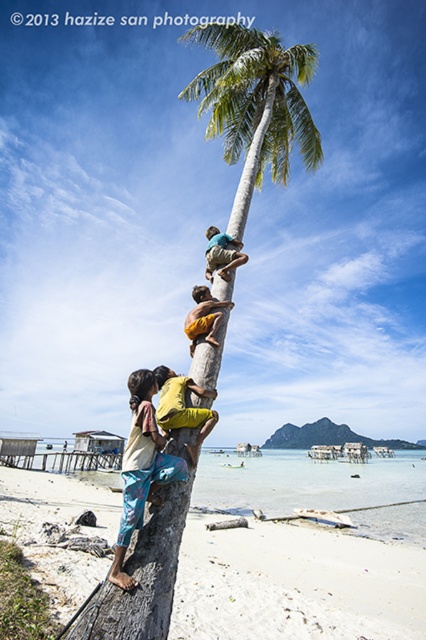
Question: Which of these objects is positioned closest to the white sand beach at lower left?

Choices:
 (A) yellow fabric at center
 (B) yellow fabric shirt at center
 (C) blue printed pants at lower left

Answer: (A)

Question: Can you confirm if blue printed pants at lower left is wider than light brown wooden pole at upper center?

Choices:
 (A) yes
 (B) no

Answer: (B)

Question: Can you confirm if blue printed pants at lower left is bigger than light brown wooden pole at upper center?

Choices:
 (A) yes
 (B) no

Answer: (B)

Question: Which of the following is the closest to the observer?

Choices:
 (A) white sand beach at lower left
 (B) yellow fabric at center
 (C) light brown wooden pole at upper center

Answer: (A)

Question: Can you confirm if yellow fabric at center is thinner than light brown wooden pole at upper center?

Choices:
 (A) no
 (B) yes

Answer: (B)

Question: Which object is closer to the camera taking this photo?

Choices:
 (A) light brown wooden pole at upper center
 (B) white sand beach at lower left
 (C) yellow fabric at center

Answer: (B)